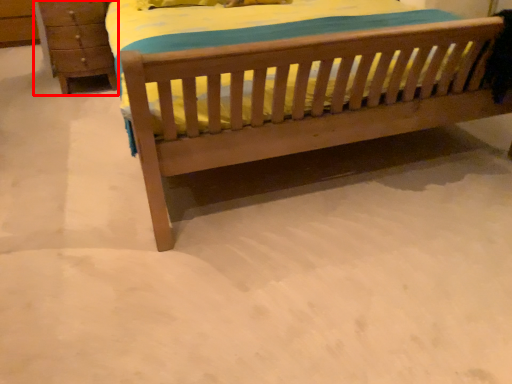
Question: From the image's perspective, what is the correct spatial relationship of chest of drawers (annotated by the red box) in relation to bed?

Choices:
 (A) above
 (B) below

Answer: (A)